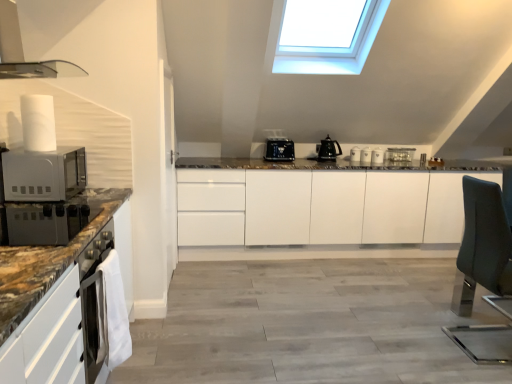
Question: Is white glossy mugs at center, which appears as the 2th appliance when viewed from the front, located within sleek metallic range hood at upper left?

Choices:
 (A) yes
 (B) no

Answer: (B)

Question: Does sleek metallic range hood at upper left lie in front of white glossy mugs at center, the 2th appliance positioned from the right?

Choices:
 (A) no
 (B) yes

Answer: (B)

Question: Does sleek metallic range hood at upper left have a greater height compared to white glossy mugs at center, positioned as the fourth appliance in left-to-right order?

Choices:
 (A) yes
 (B) no

Answer: (A)

Question: From a real-world perspective, does sleek metallic range hood at upper left stand above white glossy mugs at center, which appears as the 2th appliance when viewed from the front?

Choices:
 (A) no
 (B) yes

Answer: (B)

Question: From the image's perspective, would you say sleek metallic range hood at upper left is positioned over white glossy mugs at center, the 2th appliance positioned from the right?

Choices:
 (A) yes
 (B) no

Answer: (A)

Question: Is sleek metallic range hood at upper left smaller than white glossy mugs at center, the 4th appliance viewed from the back?

Choices:
 (A) yes
 (B) no

Answer: (B)

Question: Are teal fabric swivel chair at right and satin silver toaster at center, which appears as the fifth appliance when viewed from the front, located far from each other?

Choices:
 (A) yes
 (B) no

Answer: (A)

Question: Is teal fabric swivel chair at right taller than satin silver toaster at center, which appears as the fifth appliance when viewed from the front?

Choices:
 (A) yes
 (B) no

Answer: (A)

Question: Does teal fabric swivel chair at right contain satin silver toaster at center, which appears as the fifth appliance when viewed from the front?

Choices:
 (A) yes
 (B) no

Answer: (B)

Question: Is teal fabric swivel chair at right located outside satin silver toaster at center, which is the 1th appliance in right-to-left order?

Choices:
 (A) yes
 (B) no

Answer: (A)

Question: Is teal fabric swivel chair at right in contact with satin silver toaster at center, which is the 1th appliance in right-to-left order?

Choices:
 (A) no
 (B) yes

Answer: (A)

Question: From the image's perspective, is teal fabric swivel chair at right located beneath satin silver toaster at center, the 1th appliance positioned from the back?

Choices:
 (A) no
 (B) yes

Answer: (B)

Question: Is the depth of white glossy coffee cup at center, which is the third appliance in left-to-right order, greater than that of teal fabric swivel chair at right?

Choices:
 (A) yes
 (B) no

Answer: (A)